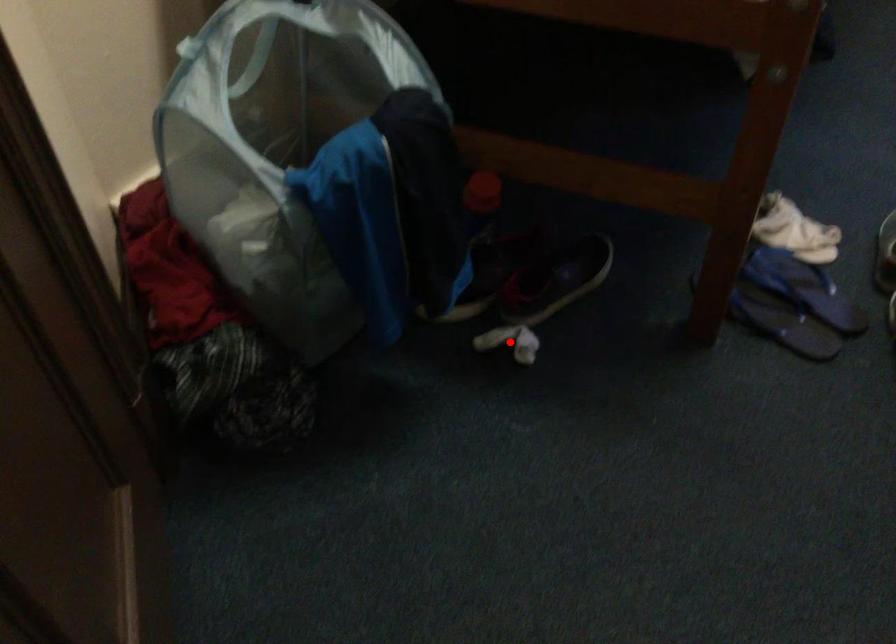
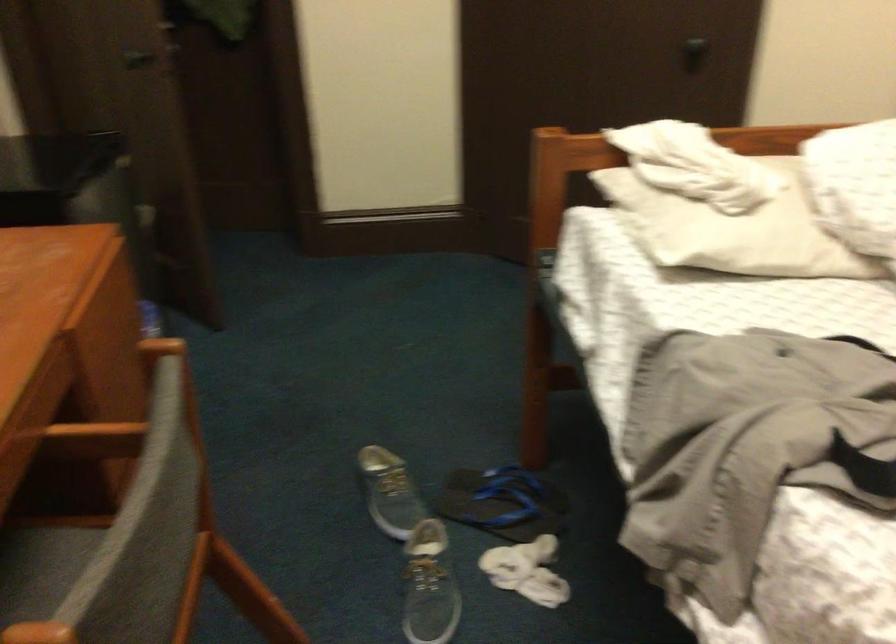
Question: I am providing you with two images of the same scene from different viewpoints. A red point is marked on the first image. Is the red point's position out of view in image 2?

Choices:
 (A) Yes
 (B) No

Answer: (A)